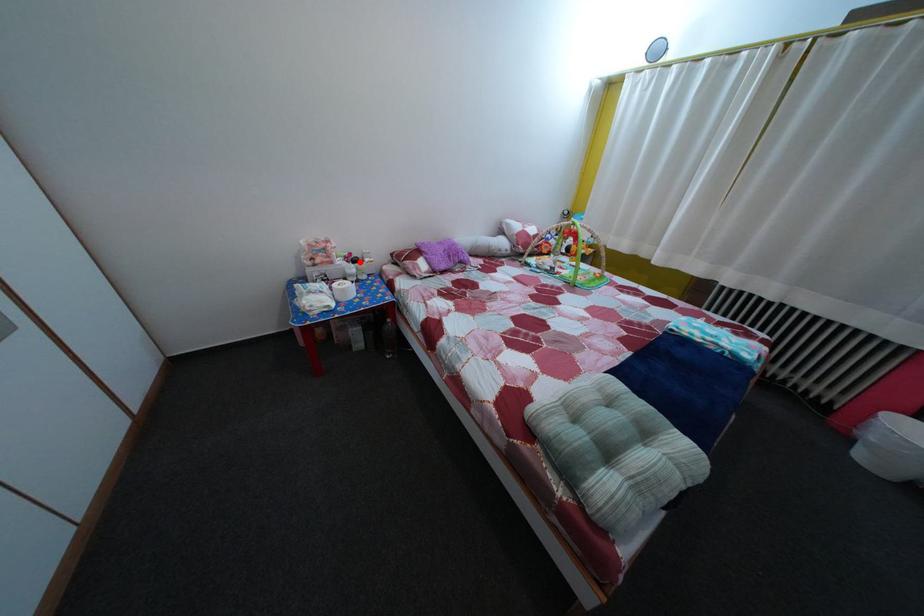
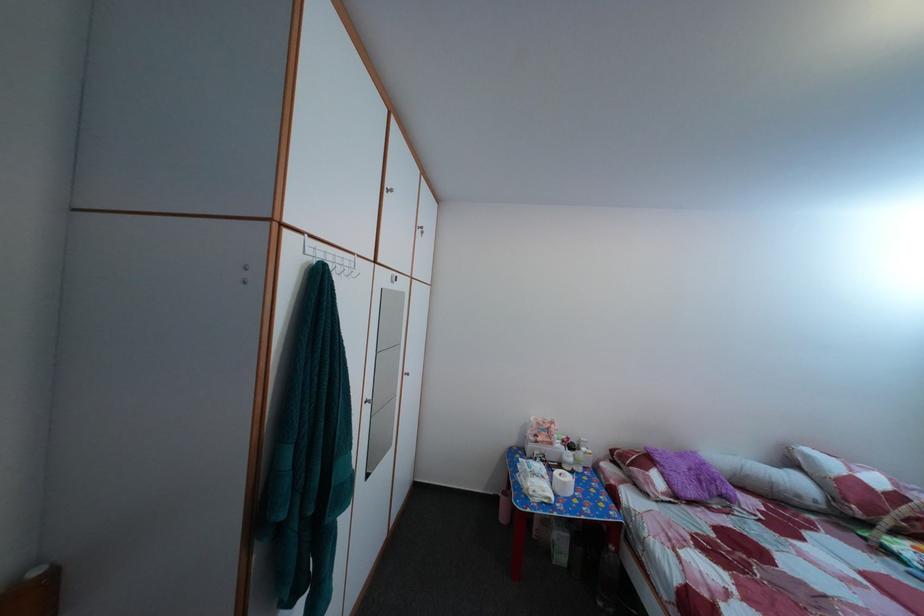
Question: I am providing you with two images of the same scene from different viewpoints. Given a red point in image1, look at the same physical point in image2. Is it:

Choices:
 (A) Closer to the viewpoint
 (B) Farther from the viewpoint

Answer: (B)